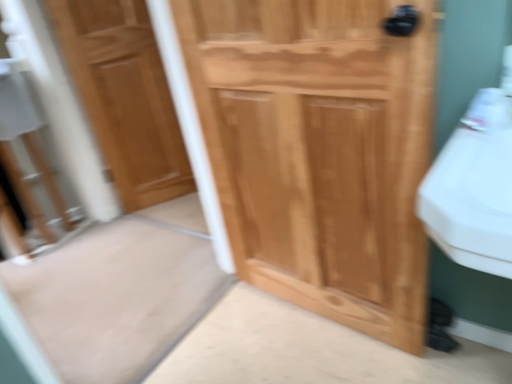
Question: Is light brown wood door at left, acting as the 1th door starting from the left, bigger than natural wood cabinet at center, which is the first door in right-to-left order?

Choices:
 (A) no
 (B) yes

Answer: (A)

Question: Considering the relative positions of light brown wood door at left, acting as the 1th door starting from the left, and natural wood cabinet at center, the second door when ordered from left to right, in the image provided, is light brown wood door at left, acting as the 1th door starting from the left, to the right of natural wood cabinet at center, the second door when ordered from left to right, from the viewer's perspective?

Choices:
 (A) yes
 (B) no

Answer: (B)

Question: From the image's perspective, would you say light brown wood door at left, marked as the second door in a right-to-left arrangement, is shown under natural wood cabinet at center, the second door when ordered from left to right?

Choices:
 (A) yes
 (B) no

Answer: (B)

Question: Is light brown wood door at left, the 2th door when ordered from front to back, oriented towards natural wood cabinet at center, arranged as the 1th door when viewed from the front?

Choices:
 (A) yes
 (B) no

Answer: (A)

Question: Does light brown wood door at left, acting as the 1th door starting from the left, have a smaller size compared to natural wood cabinet at center, arranged as the 1th door when viewed from the front?

Choices:
 (A) no
 (B) yes

Answer: (B)

Question: From a real-world perspective, is light brown wood door at left, acting as the 1th door starting from the left, on natural wood cabinet at center, the second door when ordered from left to right?

Choices:
 (A) no
 (B) yes

Answer: (B)

Question: Is natural wood cabinet at center, which is the first door in right-to-left order, further to camera compared to light brown wood door at left, the 2th door when ordered from front to back?

Choices:
 (A) no
 (B) yes

Answer: (A)

Question: Considering the relative sizes of natural wood cabinet at center, the second door when ordered from left to right, and light brown wood door at left, marked as the second door in a right-to-left arrangement, in the image provided, is natural wood cabinet at center, the second door when ordered from left to right, wider than light brown wood door at left, marked as the second door in a right-to-left arrangement,?

Choices:
 (A) no
 (B) yes

Answer: (B)

Question: Is natural wood cabinet at center, the second door when ordered from left to right, smaller than light brown wood door at left, the 2th door when ordered from front to back?

Choices:
 (A) yes
 (B) no

Answer: (B)

Question: Is natural wood cabinet at center, arranged as the 1th door when viewed from the front, thinner than light brown wood door at left, marked as the second door in a right-to-left arrangement?

Choices:
 (A) yes
 (B) no

Answer: (B)

Question: Is natural wood cabinet at center, which is the first door in right-to-left order, taller than light brown wood door at left, the 2th door when ordered from front to back?

Choices:
 (A) no
 (B) yes

Answer: (A)

Question: Is light brown wood door at left, marked as the second door in a right-to-left arrangement, completely or partially inside natural wood cabinet at center, which is the first door in right-to-left order?

Choices:
 (A) yes
 (B) no

Answer: (B)

Question: Is light brown wood door at left, acting as the 1th door starting from the left, taller or shorter than natural wood cabinet at center, the second door when ordered from left to right?

Choices:
 (A) short
 (B) tall

Answer: (B)